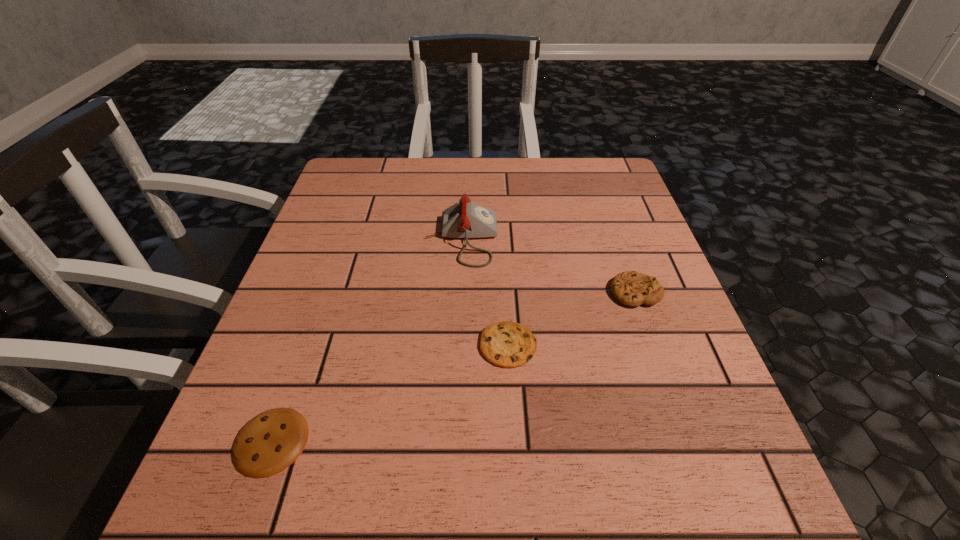
I want to click on vacant space located on the right of the second cookie from left to right, so click(x=637, y=345).

Where is `vacant space located 0.360m on the back of the leftmost cookie`? This screenshot has width=960, height=540. vacant space located 0.360m on the back of the leftmost cookie is located at coordinates (336, 258).

Where is `object present at the near edge`? This screenshot has width=960, height=540. object present at the near edge is located at coordinates (267, 444).

Where is `object that is at the left edge`? object that is at the left edge is located at coordinates (267, 444).

The width and height of the screenshot is (960, 540). In order to click on object that is at the right edge in this screenshot , I will do `click(631, 288)`.

This screenshot has width=960, height=540. Identify the location of object at the near left corner. (267, 444).

In the image, there is a desktop. Where is `vacant area at the far edge`? This screenshot has width=960, height=540. vacant area at the far edge is located at coordinates (490, 188).

Image resolution: width=960 pixels, height=540 pixels. I want to click on free region at the near edge of the desktop, so click(x=485, y=478).

Image resolution: width=960 pixels, height=540 pixels. Identify the location of free space at the left edge of the desktop. (307, 370).

The height and width of the screenshot is (540, 960). Identify the location of vacant space at the right edge. (659, 327).